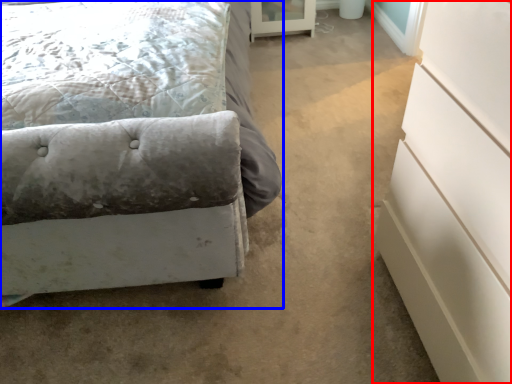
Question: Which point is closer to the camera, chest of drawers (highlighted by a red box) or bed (highlighted by a blue box)?

Choices:
 (A) chest of drawers
 (B) bed

Answer: (A)